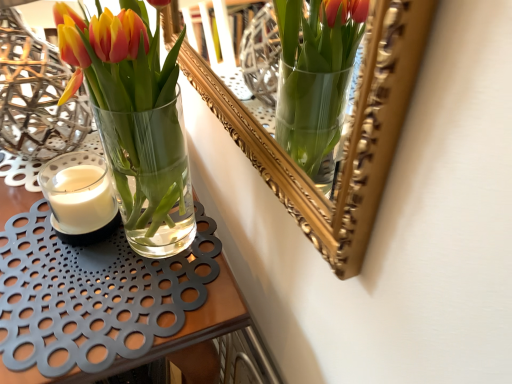
Question: Is white matte candle at left outside clear glass vase at center?

Choices:
 (A) no
 (B) yes

Answer: (B)

Question: Is white matte candle at left facing away from clear glass vase at center?

Choices:
 (A) yes
 (B) no

Answer: (B)

Question: Can you confirm if white matte candle at left is thinner than clear glass vase at center?

Choices:
 (A) no
 (B) yes

Answer: (B)

Question: Is white matte candle at left directly adjacent to clear glass vase at center?

Choices:
 (A) yes
 (B) no

Answer: (B)

Question: Can clear glass vase at center be found inside white matte candle at left?

Choices:
 (A) no
 (B) yes

Answer: (A)

Question: Is white matte candle at left aimed at clear glass vase at center?

Choices:
 (A) no
 (B) yes

Answer: (A)

Question: Is white matte candle at left completely or partially inside clear glass vase at center?

Choices:
 (A) no
 (B) yes

Answer: (A)

Question: From a real-world perspective, is clear glass vase at center located higher than white matte candle at left?

Choices:
 (A) yes
 (B) no

Answer: (B)

Question: Can you confirm if clear glass vase at center is positioned to the right of white matte candle at left?

Choices:
 (A) yes
 (B) no

Answer: (B)

Question: Does clear glass vase at center have a greater height compared to white matte candle at left?

Choices:
 (A) no
 (B) yes

Answer: (B)

Question: Is clear glass vase at center closer to the viewer compared to white matte candle at left?

Choices:
 (A) no
 (B) yes

Answer: (B)

Question: Is there a large distance between clear glass vase at center and white matte candle at left?

Choices:
 (A) yes
 (B) no

Answer: (B)

Question: Visually, is clear glass vase at center positioned to the left or to the right of white matte candle at left?

Choices:
 (A) left
 (B) right

Answer: (A)